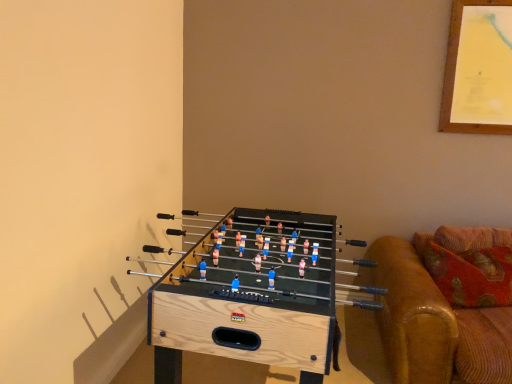
Question: From their relative heights in the image, would you say natural wood foosball table at lower left is taller or shorter than brown leather couch at right?

Choices:
 (A) short
 (B) tall

Answer: (B)

Question: Is natural wood foosball table at lower left bigger or smaller than brown leather couch at right?

Choices:
 (A) big
 (B) small

Answer: (A)

Question: From the image's perspective, is natural wood foosball table at lower left above or below brown leather couch at right?

Choices:
 (A) below
 (B) above

Answer: (A)

Question: From the image's perspective, is brown leather couch at right positioned above or below natural wood foosball table at lower left?

Choices:
 (A) above
 (B) below

Answer: (A)

Question: Relative to natural wood foosball table at lower left, is brown leather couch at right in front or behind?

Choices:
 (A) behind
 (B) front

Answer: (A)

Question: From a real-world perspective, is brown leather couch at right above or below natural wood foosball table at lower left?

Choices:
 (A) above
 (B) below

Answer: (A)

Question: In the image, is brown leather couch at right on the left side or the right side of natural wood foosball table at lower left?

Choices:
 (A) left
 (B) right

Answer: (B)